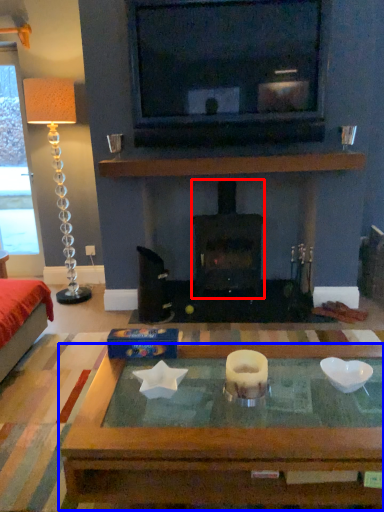
Question: Which object appears closest to the camera in this image, wood burning stove (highlighted by a red box) or coffee table (highlighted by a blue box)?

Choices:
 (A) wood burning stove
 (B) coffee table

Answer: (B)